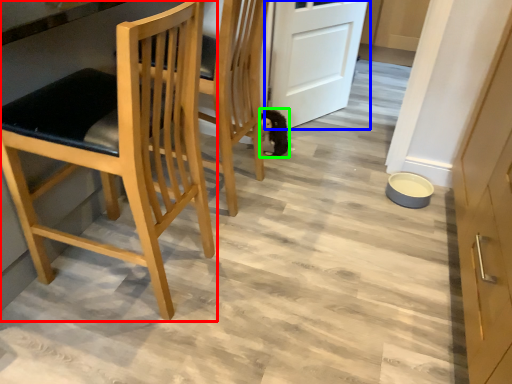
Question: Which object is the farthest from chair (highlighted by a red box)? Choose among these: door (highlighted by a blue box) or animal (highlighted by a green box).

Choices:
 (A) door
 (B) animal

Answer: (A)